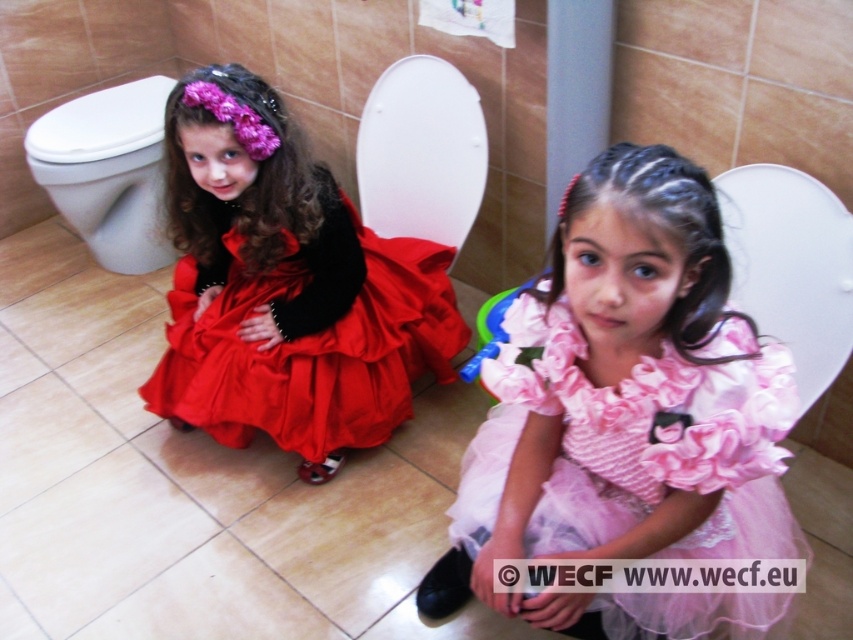
Question: Which point is closer to the camera?

Choices:
 (A) (56, 131)
 (B) (260, 280)

Answer: (B)

Question: Which is nearer to the pink satin dress at center?

Choices:
 (A) matte satin dress at left
 (B) white glossy toilet bowl at left

Answer: (A)

Question: Can you confirm if matte satin dress at left is thinner than white glossy toilet bowl at left?

Choices:
 (A) yes
 (B) no

Answer: (B)

Question: Does matte satin dress at left lie behind white glossy toilet bowl at left?

Choices:
 (A) yes
 (B) no

Answer: (B)

Question: Is the position of pink satin dress at center more distant than that of white glossy toilet bowl at left?

Choices:
 (A) no
 (B) yes

Answer: (A)

Question: Based on their relative distances, which object is nearer to the white glossy toilet bowl at left?

Choices:
 (A) matte satin dress at left
 (B) pink satin dress at center

Answer: (A)